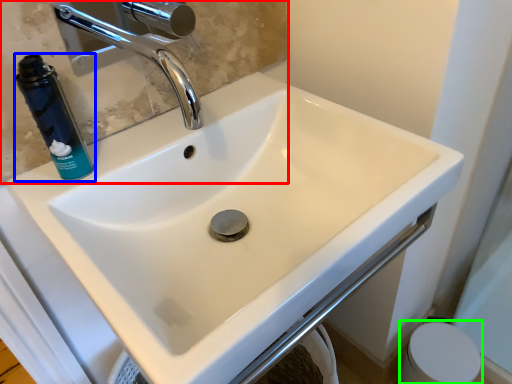
Question: Considering the real-world distances, which object is closest to mirror (highlighted by a red box)? mouthwash (highlighted by a blue box) or toilet paper (highlighted by a green box).

Choices:
 (A) mouthwash
 (B) toilet paper

Answer: (A)